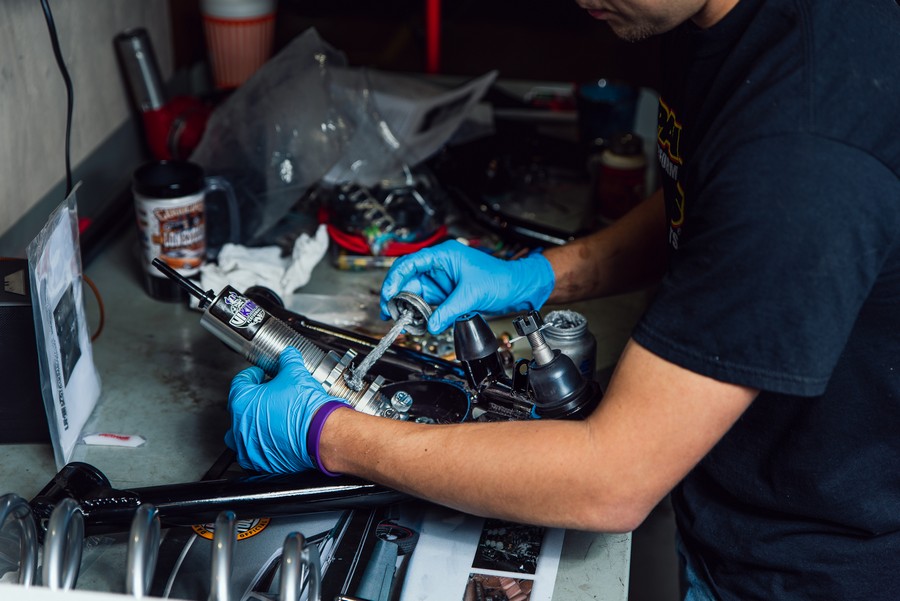
Identify the location of white papers. The height and width of the screenshot is (601, 900). (176, 216), (425, 118), (58, 258).